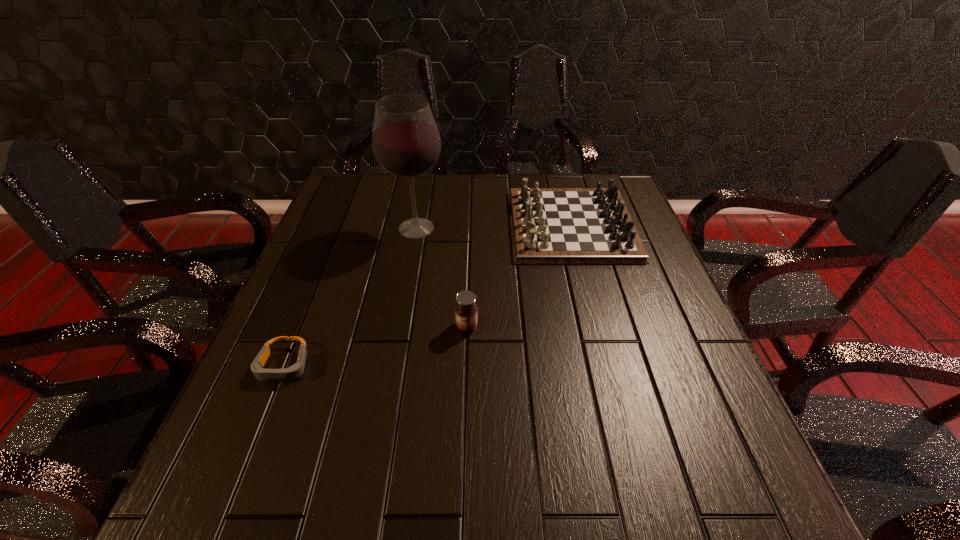
The width and height of the screenshot is (960, 540). In order to click on free space located from the player's perspective of the chessboard in this screenshot , I will do `click(418, 225)`.

I want to click on vacant space situated 0.390m from the player's perspective of the chessboard, so click(x=375, y=225).

You are a GUI agent. You are given a task and a screenshot of the screen. Output one action in this format:
    pyautogui.click(x=<x>, y=<y>)
    Task: Click on the vacant space positioned on the front and back of the shortest object
    This screenshot has height=540, width=960.
    Given the screenshot: What is the action you would take?
    pyautogui.click(x=224, y=515)

This screenshot has width=960, height=540. What are the coordinates of `alcohol that is positioned at the far edge` in the screenshot? It's located at (406, 143).

This screenshot has width=960, height=540. In order to click on chessboard that is at the far edge in this screenshot , I will do `click(548, 225)`.

Where is `object situated at the left edge`? object situated at the left edge is located at coordinates (294, 372).

Image resolution: width=960 pixels, height=540 pixels. I want to click on object situated at the right edge, so click(x=548, y=225).

Find the location of a particular element. object positioned at the far right corner is located at coordinates (548, 225).

In the image, there is a desktop. Identify the location of free space at the far edge. Image resolution: width=960 pixels, height=540 pixels. (436, 180).

This screenshot has width=960, height=540. In the image, there is a desktop. Find the location of `vacant space at the near edge`. vacant space at the near edge is located at coordinates (381, 515).